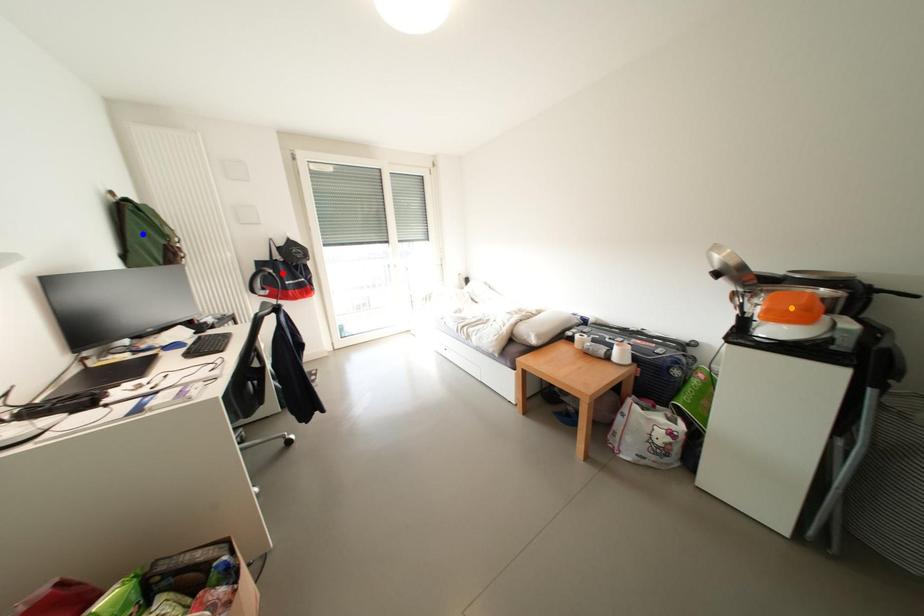
Order these from nearest to farthest:
red point | orange point | blue point

orange point, blue point, red point